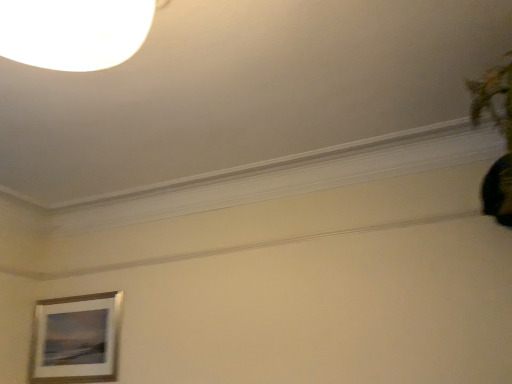
Where is `green leafy plant at upper right`? The height and width of the screenshot is (384, 512). green leafy plant at upper right is located at coordinates (499, 132).

The width and height of the screenshot is (512, 384). What do you see at coordinates (499, 132) in the screenshot?
I see `green leafy plant at upper right` at bounding box center [499, 132].

The height and width of the screenshot is (384, 512). What are the coordinates of `wooden frame at lower left` in the screenshot? It's located at (76, 339).

The width and height of the screenshot is (512, 384). Describe the element at coordinates (76, 339) in the screenshot. I see `wooden frame at lower left` at that location.

Image resolution: width=512 pixels, height=384 pixels. Identify the location of green leafy plant at upper right. (499, 132).

Considering the positions of objects green leafy plant at upper right and wooden frame at lower left in the image provided, who is more to the right, green leafy plant at upper right or wooden frame at lower left?

From the viewer's perspective, green leafy plant at upper right appears more on the right side.

Between green leafy plant at upper right and wooden frame at lower left, which one is positioned behind?

wooden frame at lower left is behind.

Does point (502, 119) come farther from viewer compared to point (102, 304)?

That is False.

From the image's perspective, relative to wooden frame at lower left, is green leafy plant at upper right above or below?

From the image's perspective, green leafy plant at upper right appears above wooden frame at lower left.

From a real-world perspective, between green leafy plant at upper right and wooden frame at lower left, who is vertically lower?

In real-world perspective, wooden frame at lower left is lower.

Considering the relative sizes of green leafy plant at upper right and wooden frame at lower left in the image provided, is green leafy plant at upper right wider than wooden frame at lower left?

Yes.

Between green leafy plant at upper right and wooden frame at lower left, which one has less height?

green leafy plant at upper right is shorter.

Which of these two, green leafy plant at upper right or wooden frame at lower left, is bigger?

green leafy plant at upper right.

Could wooden frame at lower left be considered to be inside green leafy plant at upper right?

No, wooden frame at lower left is not a part of green leafy plant at upper right.

In the scene shown: Is green leafy plant at upper right directly adjacent to wooden frame at lower left?

No, green leafy plant at upper right is not touching wooden frame at lower left.

Could you tell me if green leafy plant at upper right is facing wooden frame at lower left?

No, green leafy plant at upper right is not oriented towards wooden frame at lower left.

What's the angular difference between green leafy plant at upper right and wooden frame at lower left's facing directions?

The angular difference between green leafy plant at upper right and wooden frame at lower left is 3.91 degrees.

You are a GUI agent. You are given a task and a screenshot of the screen. Output one action in this format:
    pyautogui.click(x=<x>, y=<y>)
    Task: Click on the picture frame on the left of the green leafy plant at upper right
    Image resolution: width=512 pixels, height=384 pixels.
    Given the screenshot: What is the action you would take?
    pyautogui.click(x=76, y=339)

In the scene shown: Visually, is wooden frame at lower left positioned to the left or to the right of green leafy plant at upper right?

Based on their positions, wooden frame at lower left is located to the left of green leafy plant at upper right.

Which is behind, wooden frame at lower left or green leafy plant at upper right?

wooden frame at lower left is more distant.

Between point (69, 369) and point (508, 208), which one is positioned in front?

Point (508, 208)

From the image's perspective, is wooden frame at lower left over green leafy plant at upper right?

No, from the image's perspective, wooden frame at lower left is not above green leafy plant at upper right.

From a real-world perspective, relative to green leafy plant at upper right, is wooden frame at lower left vertically above or below?

In terms of real-world spatial position, wooden frame at lower left is below green leafy plant at upper right.

Considering the sizes of wooden frame at lower left and green leafy plant at upper right in the image, is wooden frame at lower left wider or thinner than green leafy plant at upper right?

In the image, wooden frame at lower left appears to be more narrow than green leafy plant at upper right.

Considering the sizes of objects wooden frame at lower left and green leafy plant at upper right in the image provided, who is taller, wooden frame at lower left or green leafy plant at upper right?

wooden frame at lower left is taller.

Considering the sizes of objects wooden frame at lower left and green leafy plant at upper right in the image provided, who is bigger, wooden frame at lower left or green leafy plant at upper right?

With larger size is green leafy plant at upper right.

Would you say green leafy plant at upper right is part of wooden frame at lower left's contents?

Definitely not — green leafy plant at upper right is not inside wooden frame at lower left.

Is wooden frame at lower left far from green leafy plant at upper right?

Indeed, wooden frame at lower left is not near green leafy plant at upper right.

Does wooden frame at lower left turn towards green leafy plant at upper right?

No, wooden frame at lower left is not oriented towards green leafy plant at upper right.

How much distance is there between wooden frame at lower left and green leafy plant at upper right?

The distance of wooden frame at lower left from green leafy plant at upper right is 8.65 feet.

Find the location of a particular element. picture frame on the left of green leafy plant at upper right is located at coordinates (76, 339).

Find the location of a particular element. This screenshot has height=384, width=512. picture frame behind the green leafy plant at upper right is located at coordinates (76, 339).

Find the location of a particular element. Image resolution: width=512 pixels, height=384 pixels. plant on the right side of wooden frame at lower left is located at coordinates (499, 132).